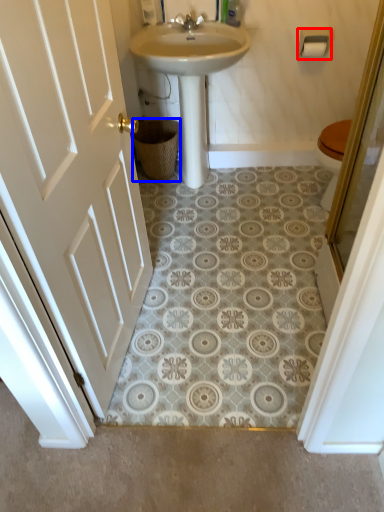
Question: Among these objects, which one is farthest to the camera, towel bar (highlighted by a red box) or basket (highlighted by a blue box)?

Choices:
 (A) towel bar
 (B) basket

Answer: (B)